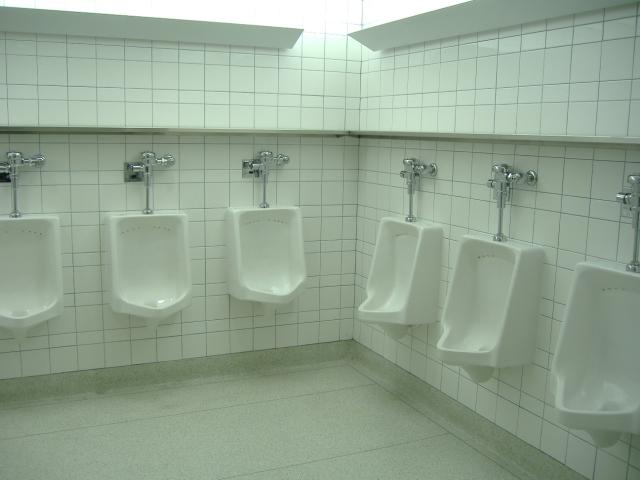
This screenshot has height=480, width=640. What are the coordinates of `urinals` in the screenshot? It's located at (42, 286), (146, 275), (296, 249), (388, 294), (477, 300), (614, 344).